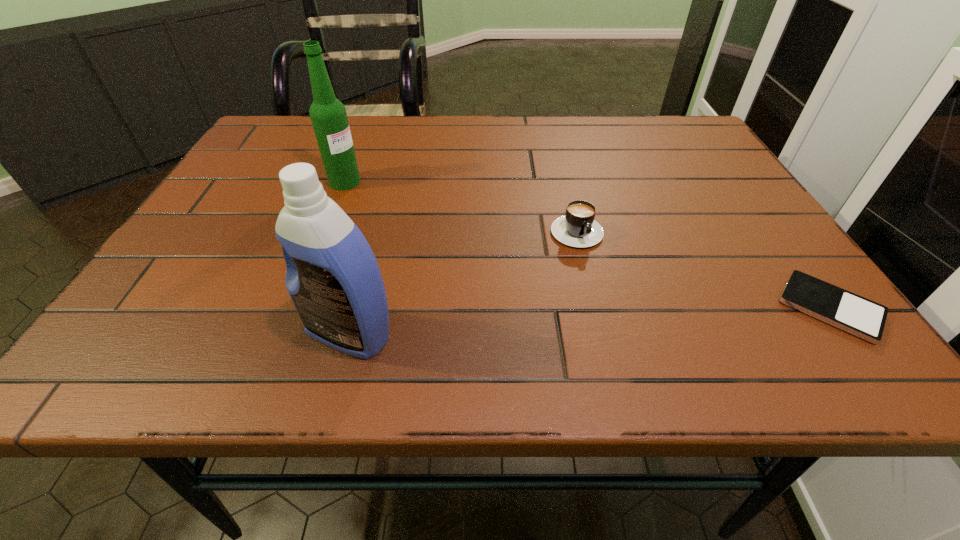
At what (x,y) coordinates should I click in order to perform the action: click on vacant space located on the label of the farthest object. Please return your answer as a coordinate pair (x, y). This screenshot has height=540, width=960. Looking at the image, I should click on (421, 214).

This screenshot has width=960, height=540. Identify the location of blank space located on the label of the farthest object. [415, 212].

At what (x,y) coordinates should I click in order to perform the action: click on detergent positioned at the near edge. Please return your answer as a coordinate pair (x, y). Looking at the image, I should click on (333, 279).

The height and width of the screenshot is (540, 960). What are the coordinates of `iPod that is at the near edge` in the screenshot? It's located at (856, 315).

I want to click on object that is at the right edge, so click(856, 315).

I want to click on object that is positioned at the near right corner, so click(x=856, y=315).

In the image, there is a desktop. In order to click on blank space at the far edge in this screenshot , I will do `click(627, 136)`.

Locate an element on the screen. This screenshot has height=540, width=960. vacant space at the near edge is located at coordinates (628, 309).

Locate an element on the screen. The width and height of the screenshot is (960, 540). free space at the left edge of the desktop is located at coordinates (263, 170).

Image resolution: width=960 pixels, height=540 pixels. I want to click on free space at the right edge, so click(x=744, y=213).